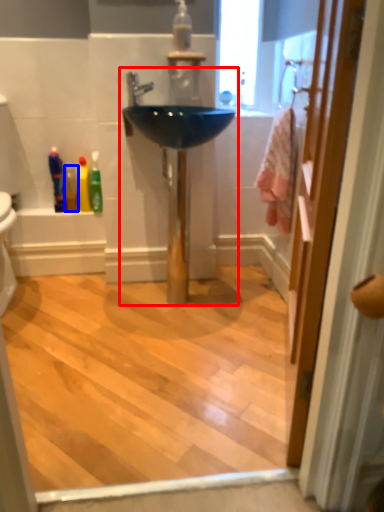
Question: Which object is closer to the camera taking this photo, sink (highlighted by a red box) or mouthwash (highlighted by a blue box)?

Choices:
 (A) sink
 (B) mouthwash

Answer: (A)